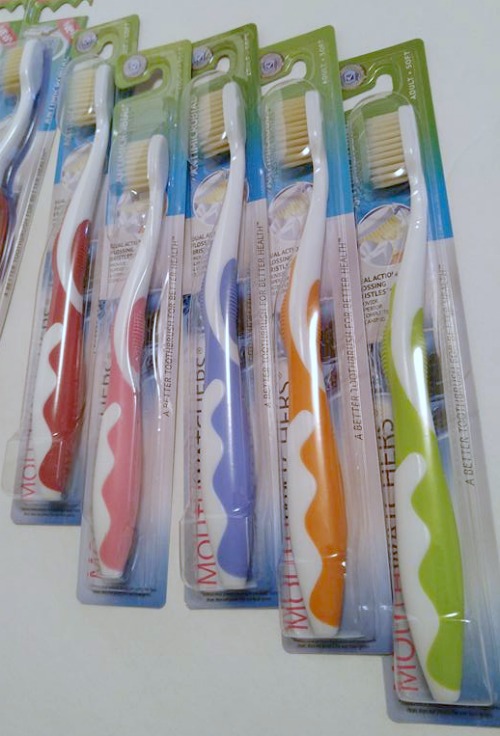
The height and width of the screenshot is (736, 500). In order to click on empty space to the right of toothbrush in this screenshot , I will do `click(476, 218)`.